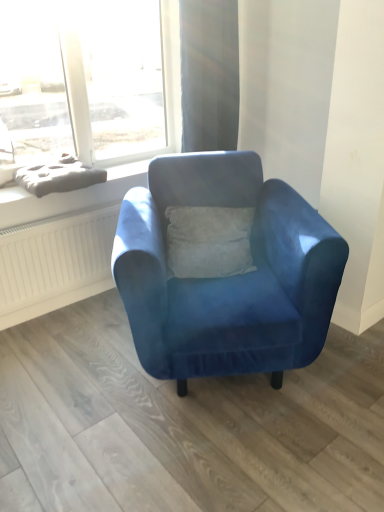
Identify the location of free space to the left of velvet blue armchair at center. (66, 368).